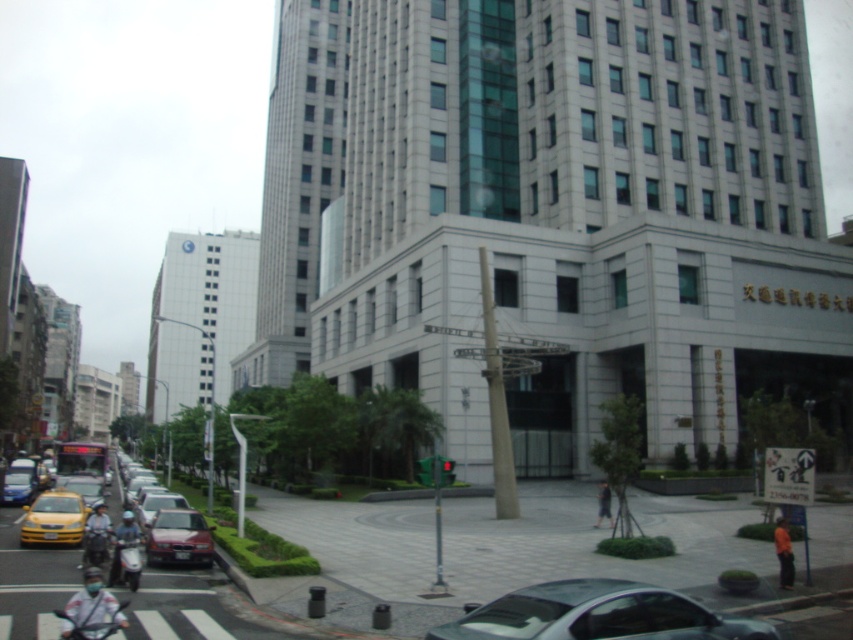
You are a delivery person needing to park your 1.8 meters wide van near the metallic gray car at lower center and the matte blue sedan at lower left. Which parking spot between them can accommodate your van?

The matte blue sedan at lower left has a wider width than the metallic gray car at lower center. Since your van is 1.8 meters wide, you should choose the parking spot next to the matte blue sedan at lower left as it likely has more space.

You are standing at the pedestrian crossing and want to take a photo of the building. There are two points marked on your camera screen, point (x=567, y=588) and point (x=189, y=516). Which point is closer to you when you look through the camera?

Point (x=567, y=588) is closer to the camera than point (x=189, y=516).

You are a pedestrian standing at the crosswalk and want to cross the street to reach the building. Which car, the metallic gray car at lower center or the shiny red car at center, is closer to you as you stand on the crosswalk?

The metallic gray car at lower center is closer to you because it is positioned in front of the shiny red car at center, meaning it is nearer to your current position on the crosswalk.